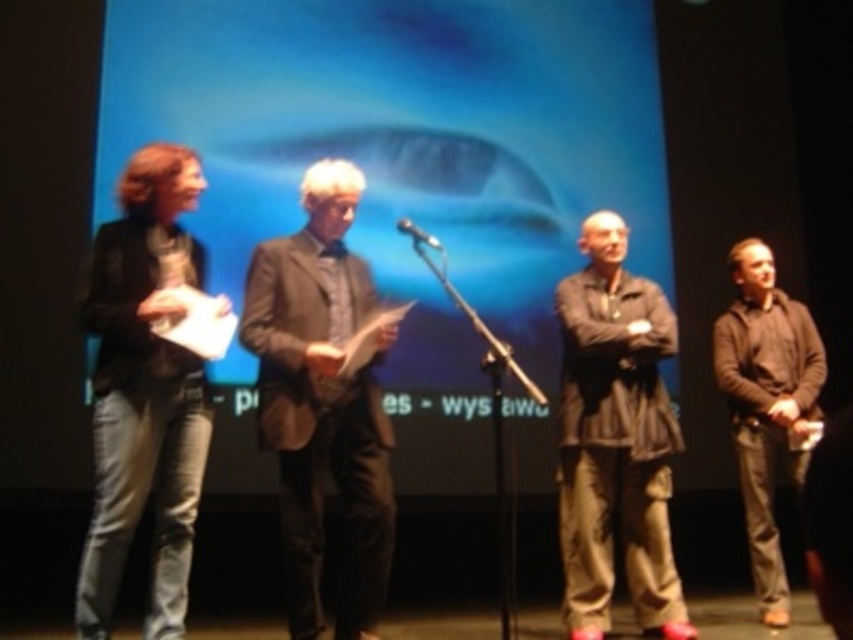
From the picture: Can you confirm if dark gray jeans at left is thinner than dark gray fabric shirt at center?

Correct, dark gray jeans at left's width is less than dark gray fabric shirt at center's.

You are a GUI agent. You are given a task and a screenshot of the screen. Output one action in this format:
    pyautogui.click(x=<x>, y=<y>)
    Task: Click on the dark gray jeans at left
    
    Given the screenshot: What is the action you would take?
    pyautogui.click(x=144, y=390)

Who is positioned more to the right, brown textured suit at center or brown cotton shirt at right?

From the viewer's perspective, brown cotton shirt at right appears more on the right side.

Is brown textured suit at center bigger than brown cotton shirt at right?

No, brown textured suit at center is not bigger than brown cotton shirt at right.

Between point (305, 360) and point (817, 422), which one is positioned behind?

Point (817, 422)

This screenshot has height=640, width=853. Find the location of `brown textured suit at center`. brown textured suit at center is located at coordinates (322, 403).

Locate an element on the screen. This screenshot has width=853, height=640. brown cotton shirt at right is located at coordinates point(767,404).

Who is positioned more to the right, brown cotton shirt at right or metallic silver microphone at center?

Positioned to the right is brown cotton shirt at right.

Where is `brown cotton shirt at right`? brown cotton shirt at right is located at coordinates (767, 404).

Locate an element on the screen. This screenshot has height=640, width=853. brown cotton shirt at right is located at coordinates pos(767,404).